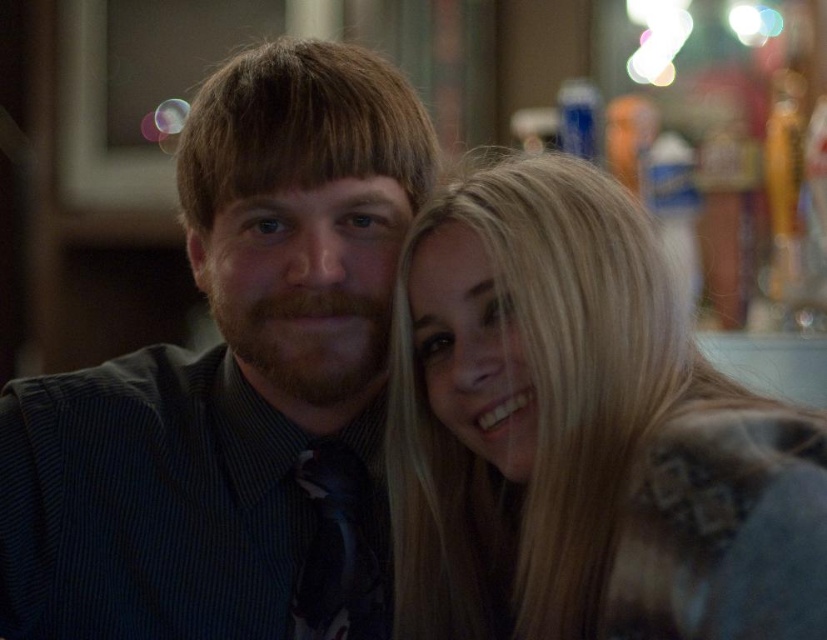
Question: Which object is farther from the camera taking this photo?

Choices:
 (A) blonde hair at upper right
 (B) matte black tie at center

Answer: (B)

Question: Based on their relative distances, which object is farther from the matte black tie at center?

Choices:
 (A) matte black shirt at center
 (B) blonde hair at upper right

Answer: (B)

Question: Is matte black shirt at center further to camera compared to matte black tie at center?

Choices:
 (A) yes
 (B) no

Answer: (B)

Question: Which point appears closest to the camera in this image?

Choices:
 (A) (550, 173)
 (B) (351, 260)

Answer: (A)

Question: Can you confirm if matte black shirt at center is positioned to the left of matte black tie at center?

Choices:
 (A) yes
 (B) no

Answer: (A)

Question: Is matte black shirt at center above matte black tie at center?

Choices:
 (A) no
 (B) yes

Answer: (B)